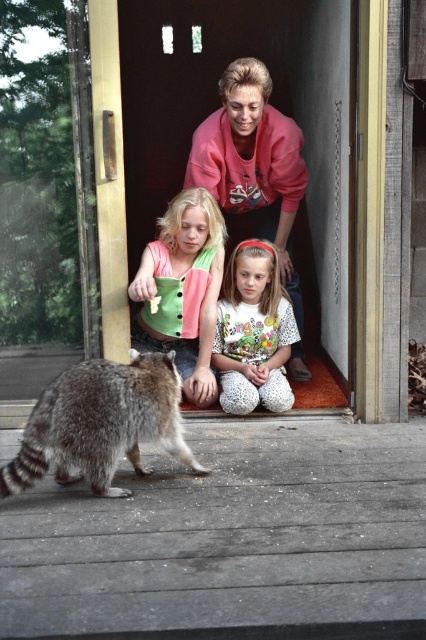
What do you see at coordinates (100, 422) in the screenshot?
I see `fuzzy gray raccoon at lower left` at bounding box center [100, 422].

Does fuzzy gray raccoon at lower left appear over white dotted pants at lower center?

No.

Between point (115, 440) and point (261, 321), which one is positioned in front?

Positioned in front is point (115, 440).

Where is `fuzzy gray raccoon at lower left`? fuzzy gray raccoon at lower left is located at coordinates (100, 422).

Who is more distant from viewer, [265,220] or [134,289]?

The point [265,220] is more distant.

Between pink fleece at center and green fabric shirt at center, which one is positioned higher?

pink fleece at center is above.

Describe the element at coordinates (253, 172) in the screenshot. The height and width of the screenshot is (640, 426). I see `pink fleece at center` at that location.

Find the location of `pink fleece at center`. pink fleece at center is located at coordinates click(253, 172).

Who is shorter, fuzzy gray raccoon at lower left or green fabric shirt at center?

With less height is fuzzy gray raccoon at lower left.

Does point (120, 410) lie behind point (193, 230)?

No, (120, 410) is closer to viewer.

Locate an element on the screen. The height and width of the screenshot is (640, 426). fuzzy gray raccoon at lower left is located at coordinates pyautogui.click(x=100, y=422).